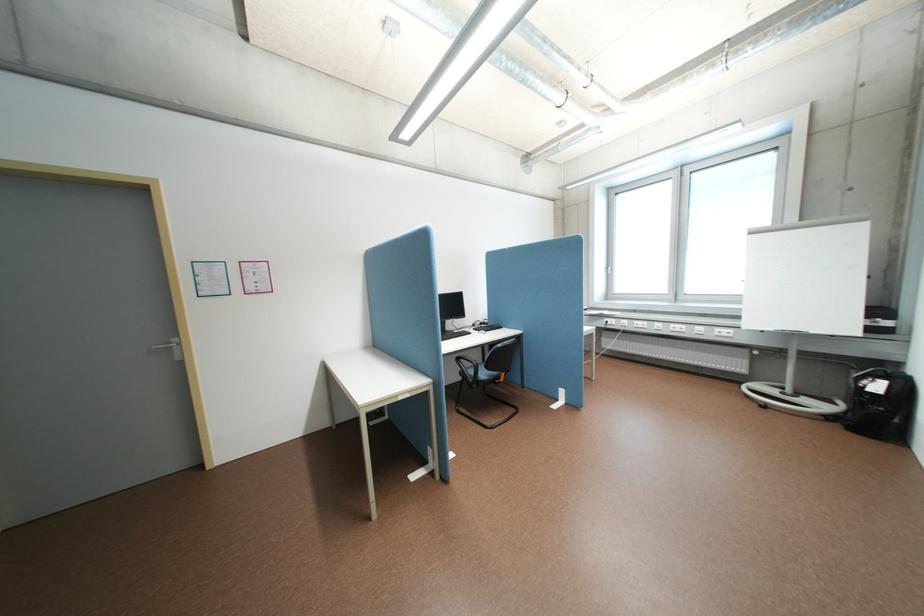
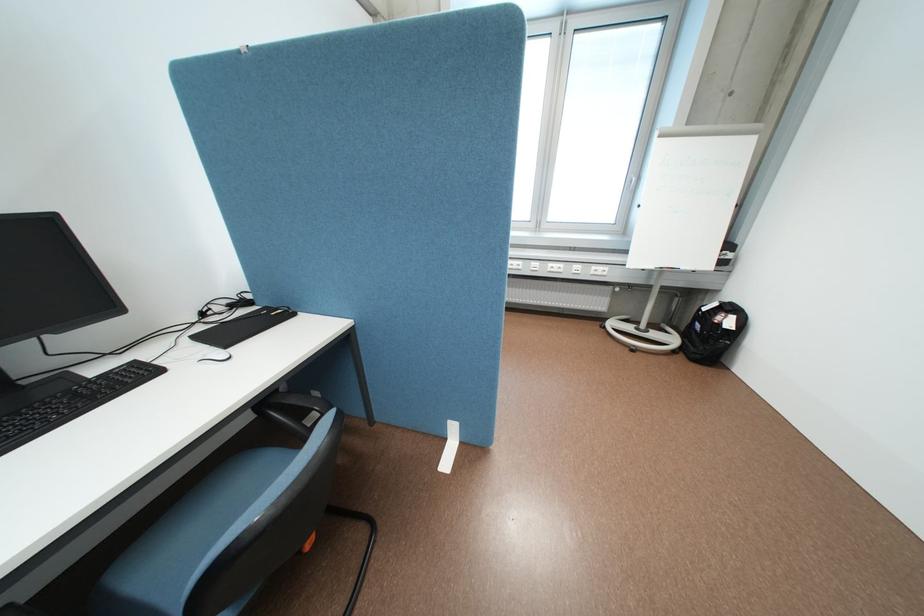
The point at (848, 424) is marked in the first image. Where is the corresponding point in the second image?

(691, 357)